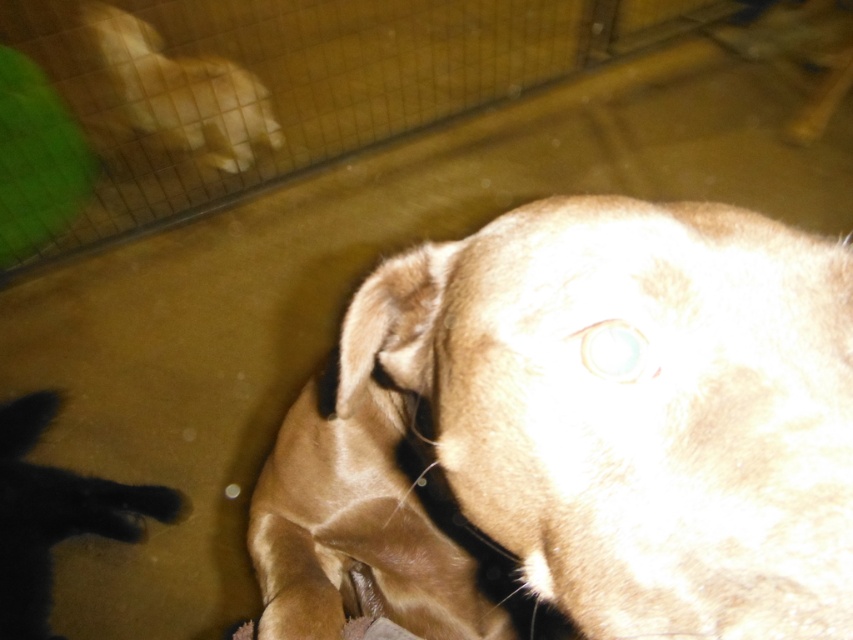
You are a visitor at the pet shelter and want to take a photo of the fuzzy brown dog at center without the fuzzy beige dog at upper left appearing in the background. Is this possible based on their positions?

The fuzzy brown dog at center is in front of the fuzzy beige dog at upper left, so if you position yourself so that the fuzzy brown dog at center blocks the view of the fuzzy beige dog at upper left, it should be possible to take a photo without the beige dog in the background.

From the picture: You are a visitor at the shelter and want to see both the fuzzy brown dog at center and the fuzzy beige dog at upper left. Which dog is closer to the right side of the image?

The fuzzy brown dog at center is positioned on the right side of the fuzzy beige dog at upper left, so it is closer to the right side of the image.